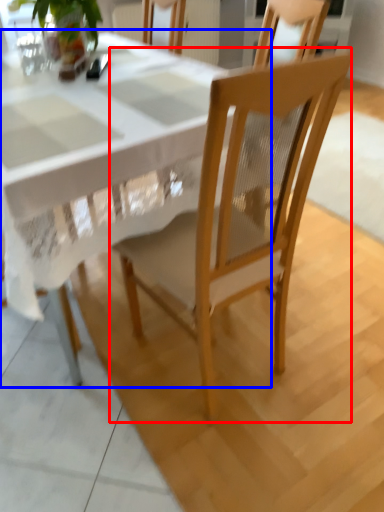
Question: Which object appears closest to the camera in this image, chair (highlighted by a red box) or round table (highlighted by a blue box)?

Choices:
 (A) chair
 (B) round table

Answer: (A)